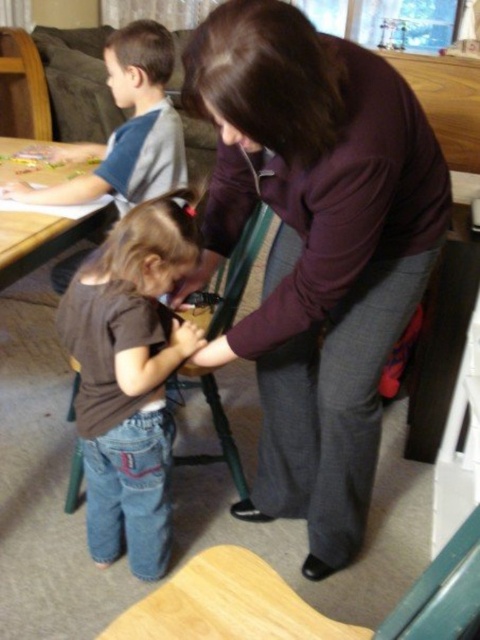
Is purple matte sweater at center further to camera compared to wooden table at left?

That is False.

How distant is purple matte sweater at center from wooden table at left?

29.30 inches

The height and width of the screenshot is (640, 480). Describe the element at coordinates (314, 248) in the screenshot. I see `purple matte sweater at center` at that location.

Locate an element on the screen. This screenshot has width=480, height=640. purple matte sweater at center is located at coordinates (314, 248).

Between purple matte sweater at center and gray-blue t-shirt at upper left, which one appears on the left side from the viewer's perspective?

gray-blue t-shirt at upper left

Who is positioned more to the right, purple matte sweater at center or gray-blue t-shirt at upper left?

purple matte sweater at center

Does point (379, 157) lie behind point (72, 257)?

That is False.

Where is `purple matte sweater at center`? This screenshot has height=640, width=480. purple matte sweater at center is located at coordinates (314, 248).

Is purple matte sweater at center thinner than brown denim jeans at lower left?

In fact, purple matte sweater at center might be wider than brown denim jeans at lower left.

Locate an element on the screen. Image resolution: width=480 pixels, height=640 pixels. purple matte sweater at center is located at coordinates (314, 248).

Image resolution: width=480 pixels, height=640 pixels. Identify the location of purple matte sweater at center. (314, 248).